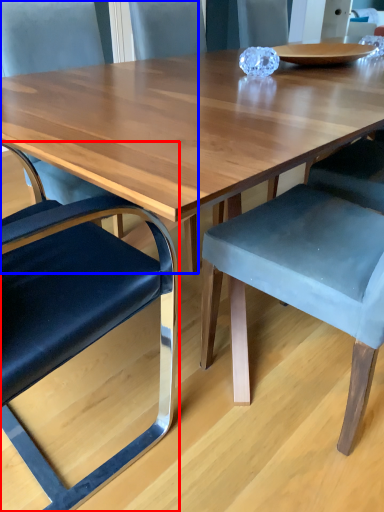
Question: Among these objects, which one is nearest to the camera, chair (highlighted by a red box) or chair (highlighted by a blue box)?

Choices:
 (A) chair
 (B) chair

Answer: (A)